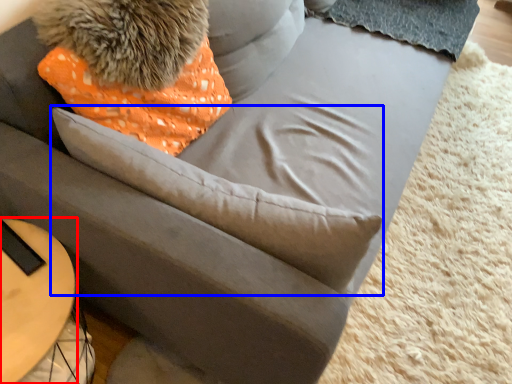
Question: Among these objects, which one is farthest to the camera, table (highlighted by a red box) or throw pillow (highlighted by a blue box)?

Choices:
 (A) table
 (B) throw pillow

Answer: (A)